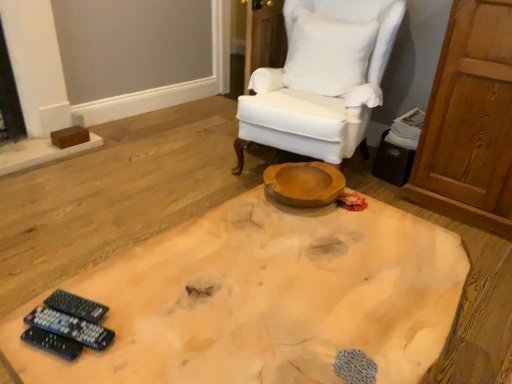
Where is `vacant space to the right of black plastic remote controls at lower left, the 3th remote control positioned from the front`? vacant space to the right of black plastic remote controls at lower left, the 3th remote control positioned from the front is located at coordinates (149, 306).